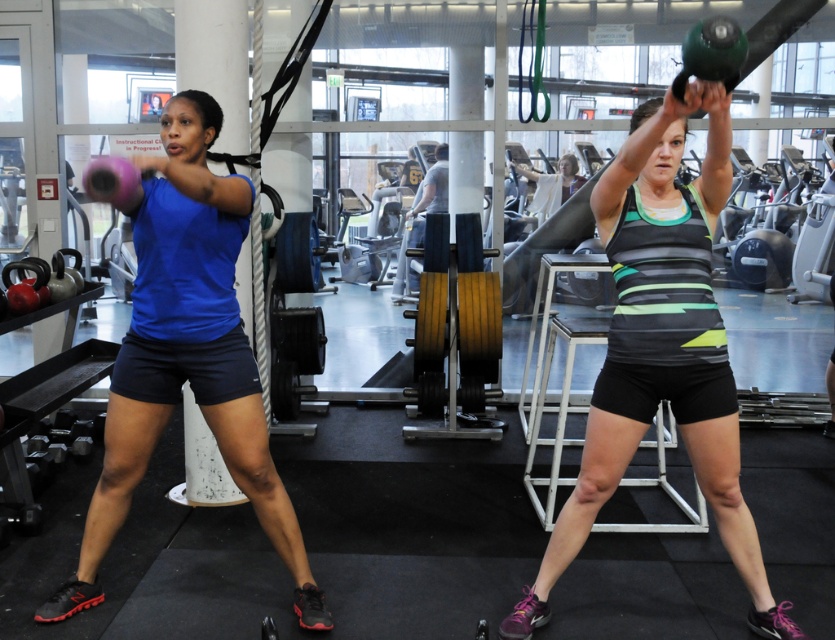
Who is more forward, (707, 300) or (167, 182)?

Positioned in front is point (707, 300).

Who is positioned more to the left, matte black kettlebell at center or matte pink kettlebell at left?

matte pink kettlebell at left

This screenshot has width=835, height=640. Describe the element at coordinates (661, 346) in the screenshot. I see `matte black kettlebell at center` at that location.

You are a GUI agent. You are given a task and a screenshot of the screen. Output one action in this format:
    pyautogui.click(x=<x>, y=<y>)
    Task: Click on the matte black kettlebell at center
    
    Given the screenshot: What is the action you would take?
    pyautogui.click(x=661, y=346)